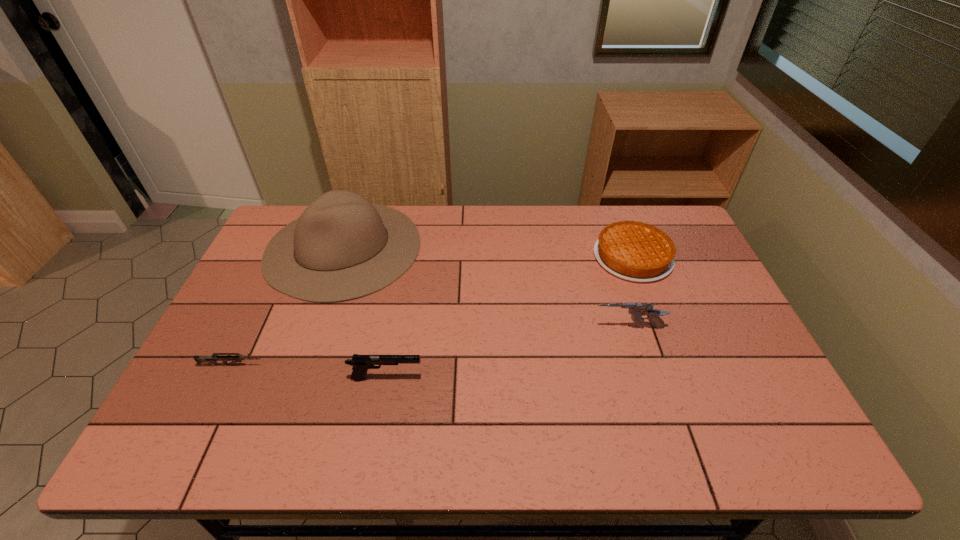
I want to click on object located in the far left corner section of the desktop, so pyautogui.click(x=347, y=248).

At what (x,y) coordinates should I click in order to perform the action: click on object present at the far right corner. Please return your answer as a coordinate pair (x, y). Looking at the image, I should click on (634, 251).

In the image, there is a desktop. At what (x,y) coordinates should I click in order to perform the action: click on free space at the far edge. Please return your answer as a coordinate pair (x, y). The height and width of the screenshot is (540, 960). Looking at the image, I should click on (573, 243).

I want to click on free region at the near edge, so click(358, 446).

This screenshot has height=540, width=960. In the image, there is a desktop. In order to click on vacant space at the left edge in this screenshot , I will do tap(242, 410).

This screenshot has height=540, width=960. Find the location of `blank space at the right edge of the desktop`. blank space at the right edge of the desktop is located at coordinates pos(733,345).

The height and width of the screenshot is (540, 960). I want to click on free region at the far right corner, so click(x=679, y=244).

You are a GUI agent. You are given a task and a screenshot of the screen. Output one action in this format:
    pyautogui.click(x=<x>, y=<y>)
    Task: Click on the empty space between the rightmost gun and the sombrero
    This screenshot has width=960, height=540.
    Given the screenshot: What is the action you would take?
    pyautogui.click(x=486, y=288)

Where is `free space between the nearest gun and the farthest gun`? free space between the nearest gun and the farthest gun is located at coordinates (507, 353).

What are the coordinates of `vacant area that lies between the nearest object and the third farthest object` in the screenshot? It's located at (507, 353).